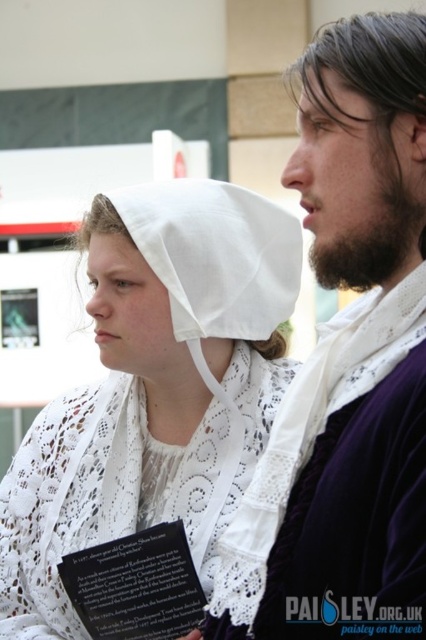
You are a photographer at a historical event. You need to take a photo of the velvet purple robe at center and the white lace bonnet at center. Which object is located to the right of the other?

The velvet purple robe at center is positioned on the right side of white lace bonnet at center.

In the scene shown: You are an event organizer checking the setup for a historical reenactment. You notice the velvet purple robe at center and the white cotton bonnet at center. Which item is covering part of the other?

The velvet purple robe at center is positioned over the white cotton bonnet at center, so the robe is covering part of the bonnet.

You are an event organizer setting up a historical reenactment. You need to ensure that the velvet purple robe at center and the white lace bonnet at center are visible to the audience. Based on their current positions, which object is blocking the view of the other?

The velvet purple robe at center is positioned over the white lace bonnet at center, so the velvet purple robe at center is blocking the view of the white lace bonnet at center.